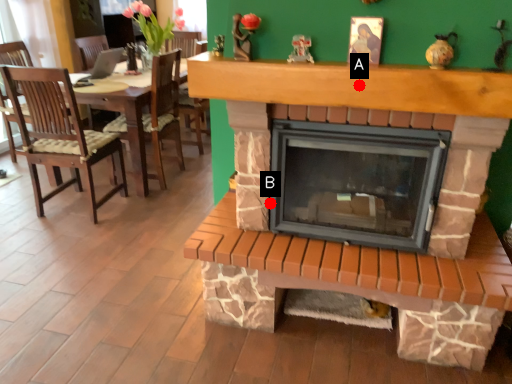
Question: Two points are circled on the image, labeled by A and B beside each circle. Which point is further to the camera?

Choices:
 (A) A is further
 (B) B is further

Answer: (B)